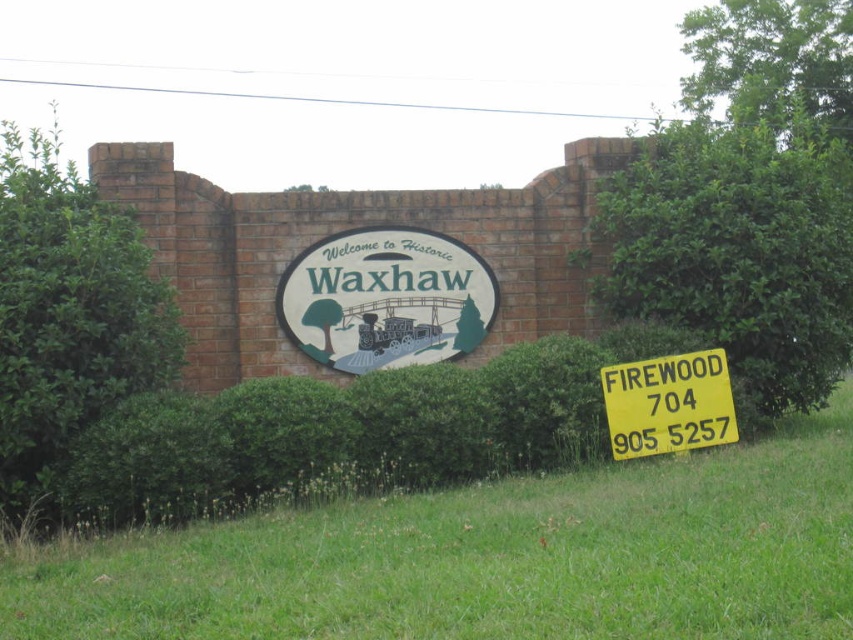
Is green leafy bush at left behind yellow plastic sign at lower right?

No, green leafy bush at left is in front of yellow plastic sign at lower right.

Locate an element on the screen. This screenshot has width=853, height=640. green leafy bush at left is located at coordinates click(x=68, y=310).

I want to click on green leafy bush at left, so click(68, 310).

This screenshot has height=640, width=853. What are the coordinates of `green leafy bush at right` in the screenshot? It's located at (737, 246).

Is green leafy bush at right below white painted wood sign at center?

Incorrect, green leafy bush at right is not positioned below white painted wood sign at center.

Is point (746, 282) positioned behind point (341, 240)?

No, (746, 282) is in front of (341, 240).

You are a GUI agent. You are given a task and a screenshot of the screen. Output one action in this format:
    pyautogui.click(x=<x>, y=<y>)
    Task: Click on the green leafy bush at right
    
    Given the screenshot: What is the action you would take?
    pyautogui.click(x=737, y=246)

Who is lower down, green leafy bush at right or yellow plastic sign at lower right?

yellow plastic sign at lower right is lower down.

Can you confirm if green leafy bush at right is wider than yellow plastic sign at lower right?

Correct, the width of green leafy bush at right exceeds that of yellow plastic sign at lower right.

What do you see at coordinates (737, 246) in the screenshot? I see `green leafy bush at right` at bounding box center [737, 246].

Identify the location of green leafy bush at right. Image resolution: width=853 pixels, height=640 pixels. (737, 246).